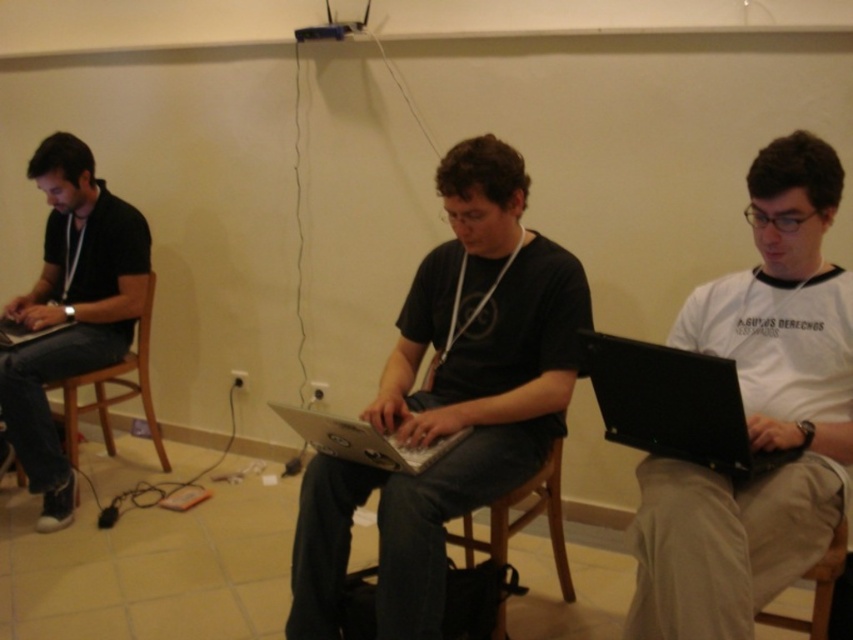
Question: Which object is closer to the camera taking this photo?

Choices:
 (A) matte black laptop at left
 (B) wooden chair at lower right
 (C) white matte shirt at right

Answer: (C)

Question: Does black matte laptop at center appear on the left side of black glossy laptop at right?

Choices:
 (A) yes
 (B) no

Answer: (A)

Question: Is white matte shirt at right to the right of wooden chair at lower right from the viewer's perspective?

Choices:
 (A) yes
 (B) no

Answer: (B)

Question: Which point is closer to the camera taking this photo?

Choices:
 (A) 18,337
 (B) 614,369
 (C) 717,602
 (D) 426,392

Answer: (C)

Question: In this image, where is wooden chair at center located relative to matte black laptop at left?

Choices:
 (A) right
 (B) left

Answer: (A)

Question: Which object is the farthest from the wooden chair at lower right?

Choices:
 (A) black glossy laptop at right
 (B) silver metallic laptop at center
 (C) black matte laptop at center

Answer: (B)